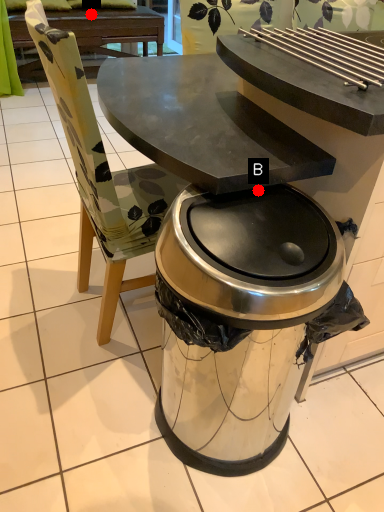
Question: Two points are circled on the image, labeled by A and B beside each circle. Which point is closer to the camera?

Choices:
 (A) A is closer
 (B) B is closer

Answer: (B)